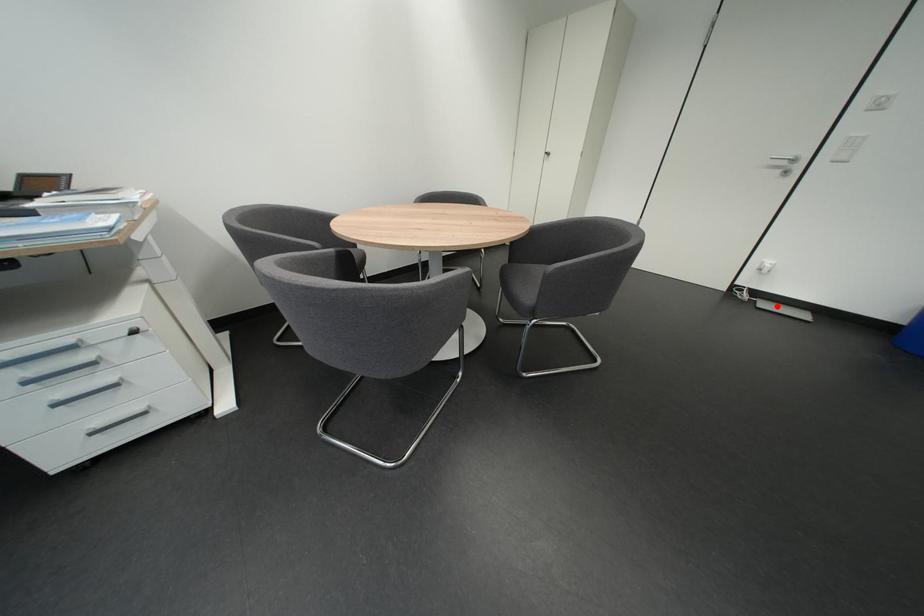
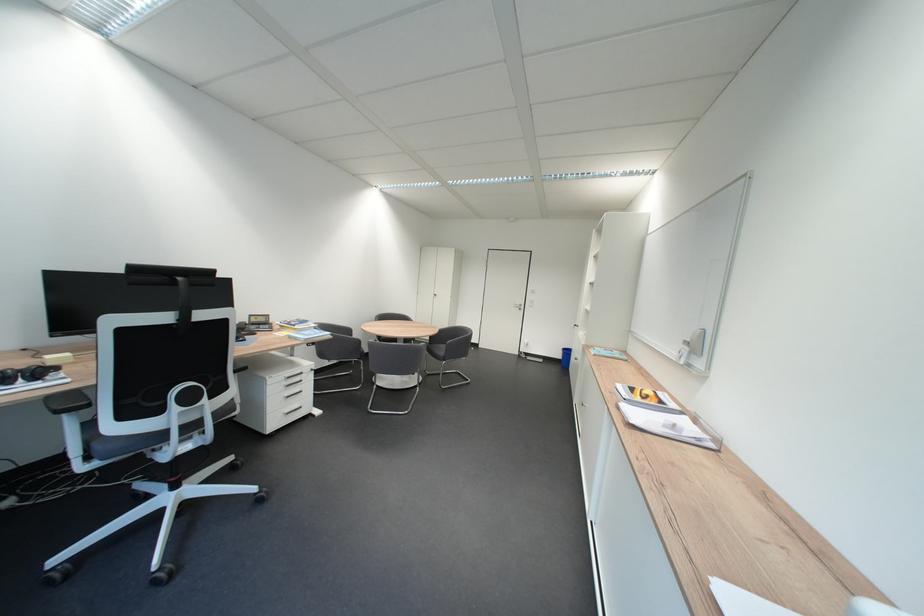
Locate, in the second image, the point that corresponds to the highlighted location in the first image.

(541, 360)